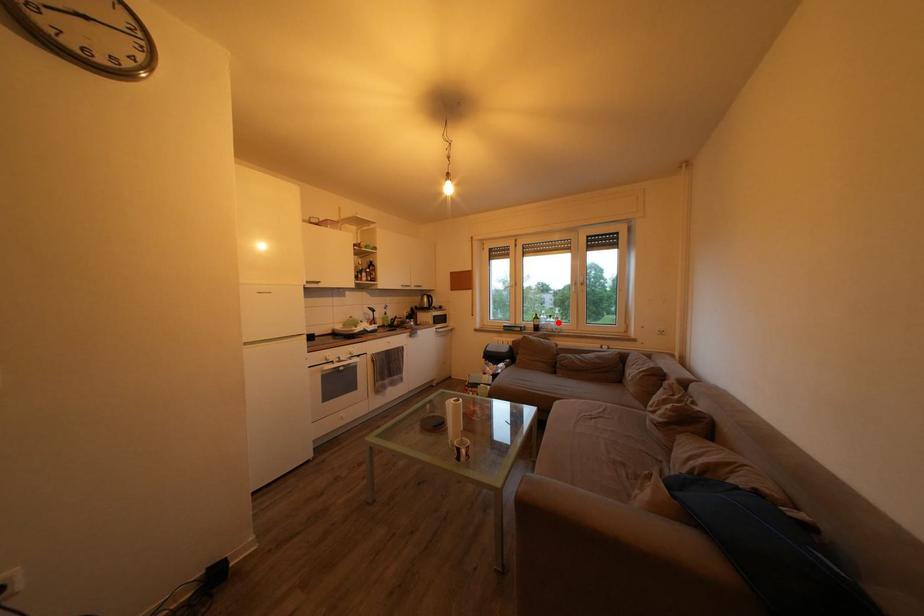
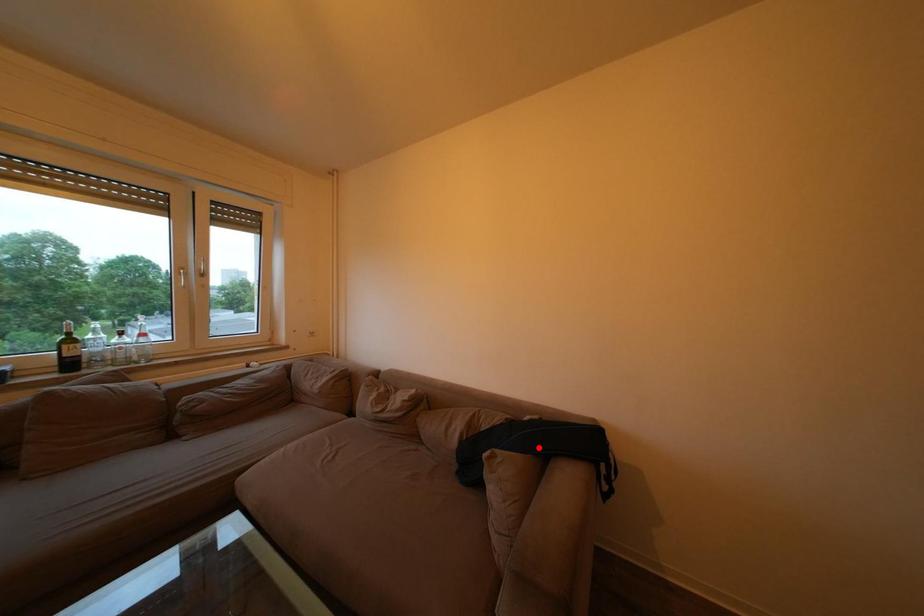
I am providing you with two images of the same scene from different viewpoints. A red point is marked on the first image and another point is marked on the second image. Does the point marked in image1 correspond to the same location as the one in image2?

No